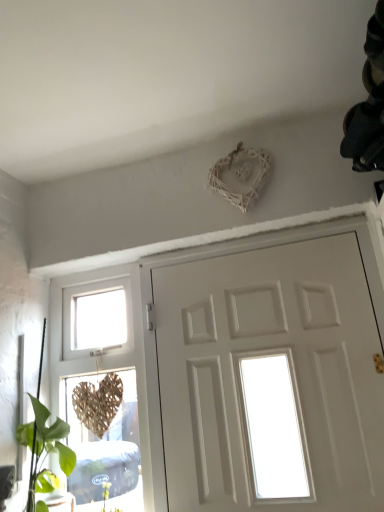
The image size is (384, 512). What do you see at coordinates (272, 361) in the screenshot?
I see `white matte door at center` at bounding box center [272, 361].

Measure the distance between point (357, 492) and camera.

Point (357, 492) is 1.36 meters from camera.

You are a GUI agent. You are given a task and a screenshot of the screen. Output one action in this format:
    pyautogui.click(x=<x>, y=<y>)
    Task: Click on the white matte door at center
    
    Given the screenshot: What is the action you would take?
    pyautogui.click(x=272, y=361)

Image resolution: width=384 pixels, height=512 pixels. What do you see at coordinates (109, 365) in the screenshot?
I see `woven wood heart at left` at bounding box center [109, 365].

Measure the distance between point (57, 301) and camera.

The depth of point (57, 301) is 6.15 feet.

Find the location of `woven wood heart at left`. woven wood heart at left is located at coordinates (109, 365).

Image resolution: width=384 pixels, height=512 pixels. Identify the location of white matte door at center. (272, 361).

Between woven wood heart at left and white matte door at center, which one appears on the left side from the viewer's perspective?

Positioned to the left is woven wood heart at left.

Considering the positions of objects woven wood heart at left and white matte door at center in the image provided, who is behind, woven wood heart at left or white matte door at center?

Positioned behind is woven wood heart at left.

Is point (87, 366) positioned in front of point (227, 442)?

No, it is behind (227, 442).

From the image's perspective, is woven wood heart at left below white matte door at center?

Correct, woven wood heart at left appears lower than white matte door at center in the image.

From a real-world perspective, does woven wood heart at left stand above white matte door at center?

Correct, in the physical world, woven wood heart at left is higher than white matte door at center.

Between woven wood heart at left and white matte door at center, which one has larger width?

With larger width is woven wood heart at left.

Considering the sizes of objects woven wood heart at left and white matte door at center in the image provided, who is taller, woven wood heart at left or white matte door at center?

Standing taller between the two is woven wood heart at left.

Which of these two, woven wood heart at left or white matte door at center, is smaller?

Smaller between the two is woven wood heart at left.

Is woven wood heart at left spatially inside white matte door at center, or outside of it?

woven wood heart at left is not inside white matte door at center, it's outside.

Is woven wood heart at left next to white matte door at center and touching it?

woven wood heart at left and white matte door at center are clearly separated.

Is woven wood heart at left turned away from white matte door at center?

No, woven wood heart at left is not facing the opposite direction of white matte door at center.

How far apart are woven wood heart at left and white matte door at center?

A distance of 35.66 centimeters exists between woven wood heart at left and white matte door at center.

Identify the location of window above the white matte door at center (from a real-world perspective). (109, 365).

Considering the relative positions of white matte door at center and woven wood heart at left in the image provided, is white matte door at center to the left of woven wood heart at left from the viewer's perspective?

In fact, white matte door at center is to the right of woven wood heart at left.

Is white matte door at center positioned behind woven wood heart at left?

No, it is in front of woven wood heart at left.

Considering the positions of points (255, 476) and (57, 301), is point (255, 476) closer to camera compared to point (57, 301)?

Yes, it is in front of point (57, 301).

From the image's perspective, between white matte door at center and woven wood heart at left, which one is located above?

From the image's view, white matte door at center is above.

From a real-world perspective, is white matte door at center physically located above or below woven wood heart at left?

white matte door at center is situated lower than woven wood heart at left in the real world.

In terms of width, does white matte door at center look wider or thinner when compared to woven wood heart at left?

white matte door at center is thinner than woven wood heart at left.

Does white matte door at center have a lesser height compared to woven wood heart at left?

Indeed, white matte door at center has a lesser height compared to woven wood heart at left.

Does white matte door at center have a larger size compared to woven wood heart at left?

Indeed, white matte door at center has a larger size compared to woven wood heart at left.

Can woven wood heart at left be found inside white matte door at center?

Actually, woven wood heart at left is outside white matte door at center.

Is white matte door at center far away from woven wood heart at left?

white matte door at center is actually quite close to woven wood heart at left.

Is woven wood heart at left at the back of white matte door at center?

No, white matte door at center is not facing away from woven wood heart at left.

What's the angular difference between white matte door at center and woven wood heart at left's facing directions?

The facing directions of white matte door at center and woven wood heart at left are 8.61e-05 degrees apart.

Locate an element on the screen. The height and width of the screenshot is (512, 384). door on the right of woven wood heart at left is located at coordinates (272, 361).

This screenshot has height=512, width=384. Identify the location of window that appears on the left of white matte door at center. (109, 365).

At what (x,y) coordinates should I click in order to perform the action: click on window that is below the white matte door at center (from the image's perspective). Please return your answer as a coordinate pair (x, y). Looking at the image, I should click on (109, 365).